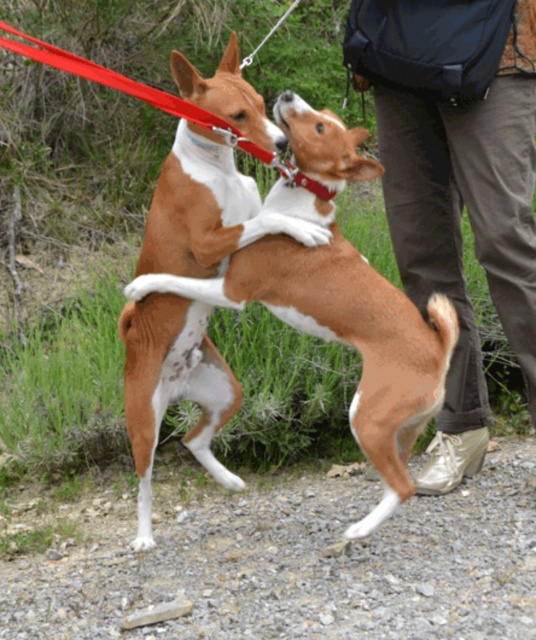
Is point (516, 323) in front of point (331, 170)?

No, (516, 323) is further to viewer.

Is brown suede pants at lower right taller than brown/white fur dog at center?

Yes, brown suede pants at lower right is taller than brown/white fur dog at center.

This screenshot has height=640, width=536. Find the location of `brown suede pants at lower right`. brown suede pants at lower right is located at coordinates (457, 184).

Locate an element on the screen. The image size is (536, 640). brown suede pants at lower right is located at coordinates (457, 184).